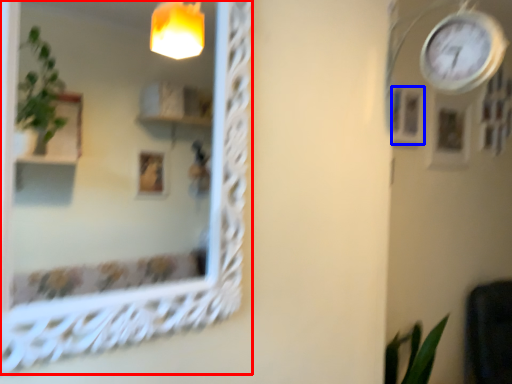
Question: Which point is closer to the camera, mirror (highlighted by a red box) or picture frame (highlighted by a blue box)?

Choices:
 (A) mirror
 (B) picture frame

Answer: (A)